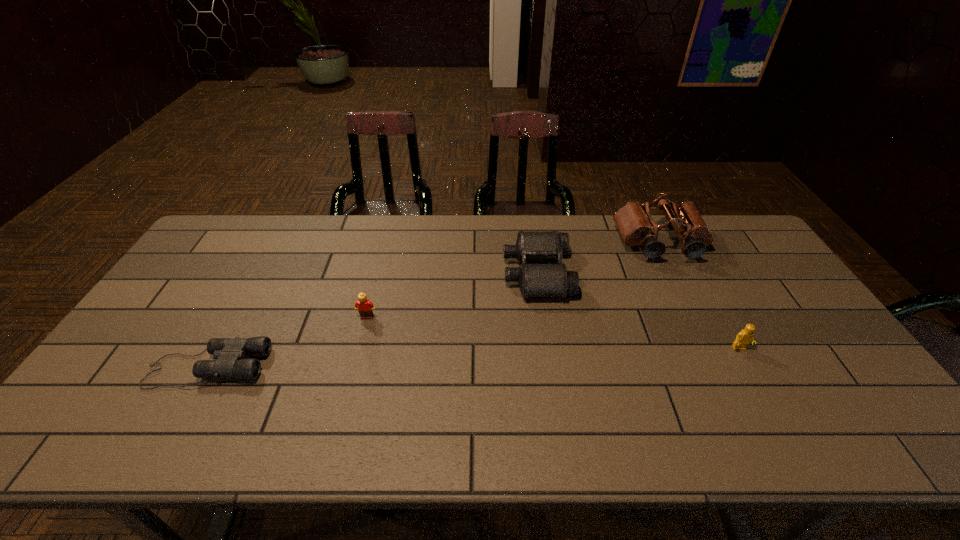
Locate an element on the screen. blank space at the right edge of the desktop is located at coordinates (752, 304).

Find the location of a particular element. The width and height of the screenshot is (960, 540). free region at the far left corner of the desktop is located at coordinates (233, 247).

Find the location of `vacant region between the nearer Lego and the second binoculars from right to left`. vacant region between the nearer Lego and the second binoculars from right to left is located at coordinates (638, 310).

Locate an element on the screen. This screenshot has height=540, width=960. free area in between the second shortest binoculars and the nearer Lego is located at coordinates (638, 310).

The image size is (960, 540). What are the coordinates of `vacant area that lies between the tallest binoculars and the second shortest binoculars` in the screenshot? It's located at (598, 258).

I want to click on free point between the rightmost binoculars and the nearer Lego, so click(700, 296).

The width and height of the screenshot is (960, 540). Identify the location of free space between the second object from left to right and the third object from left to right. (452, 295).

Where is `free area in between the leftmost object and the tallest binoculars`? This screenshot has height=540, width=960. free area in between the leftmost object and the tallest binoculars is located at coordinates 434,306.

Locate an element on the screen. The height and width of the screenshot is (540, 960). empty space between the second tallest binoculars and the rightmost binoculars is located at coordinates (598, 258).

The image size is (960, 540). Find the location of `vacant point located between the nearer Lego and the tallest binoculars`. vacant point located between the nearer Lego and the tallest binoculars is located at coordinates (700, 296).